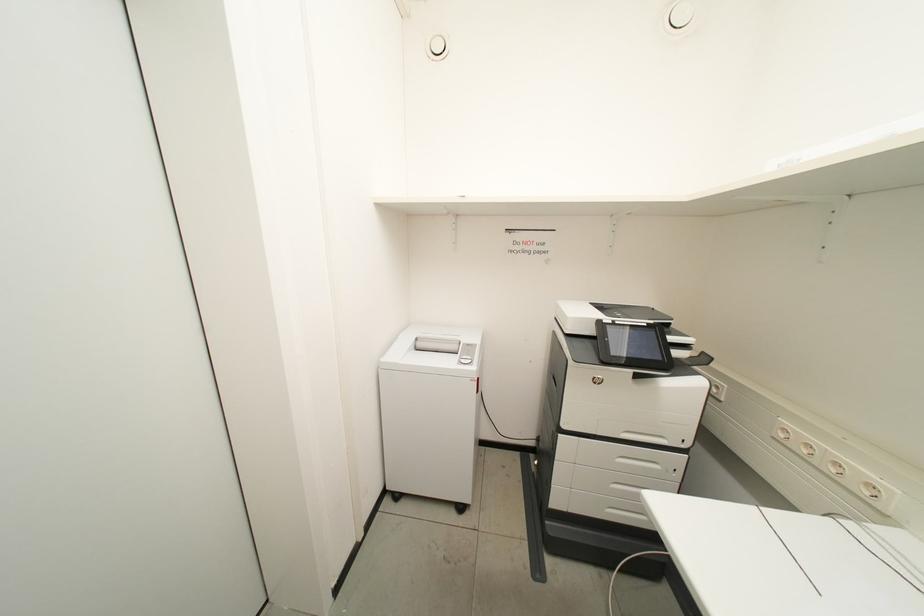
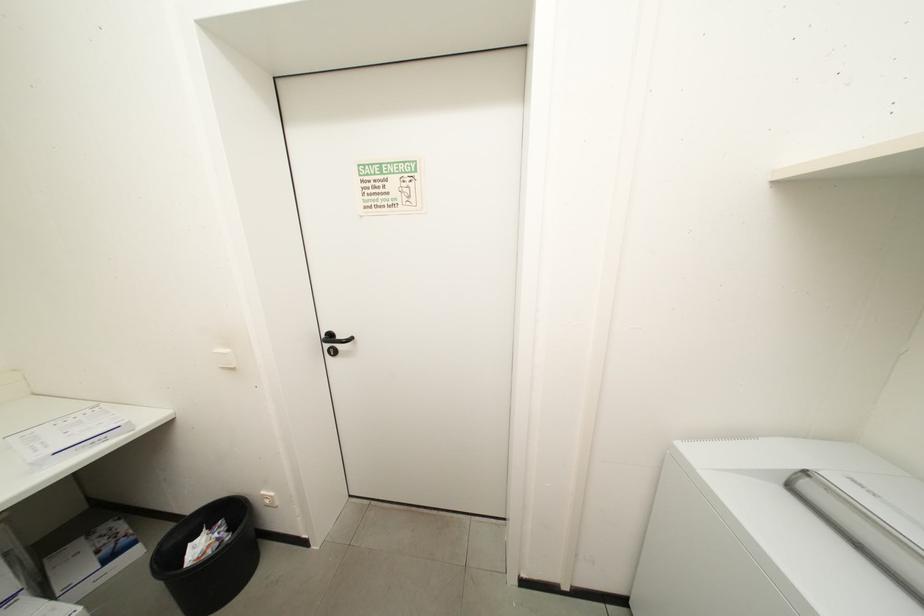
Question: Based on the continuous images, in which direction is the camera rotating? Reply with the corresponding letter.

Choices:
 (A) Left
 (B) Right
 (C) Up
 (D) Down

Answer: (A)